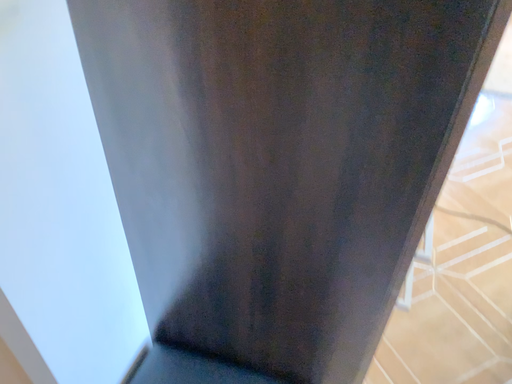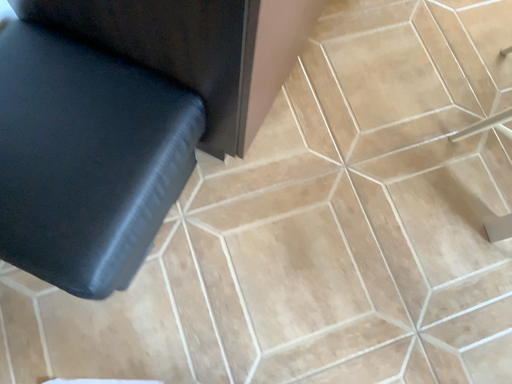
Question: Which way did the camera rotate in the video?

Choices:
 (A) rotated upward
 (B) rotated downward

Answer: (B)